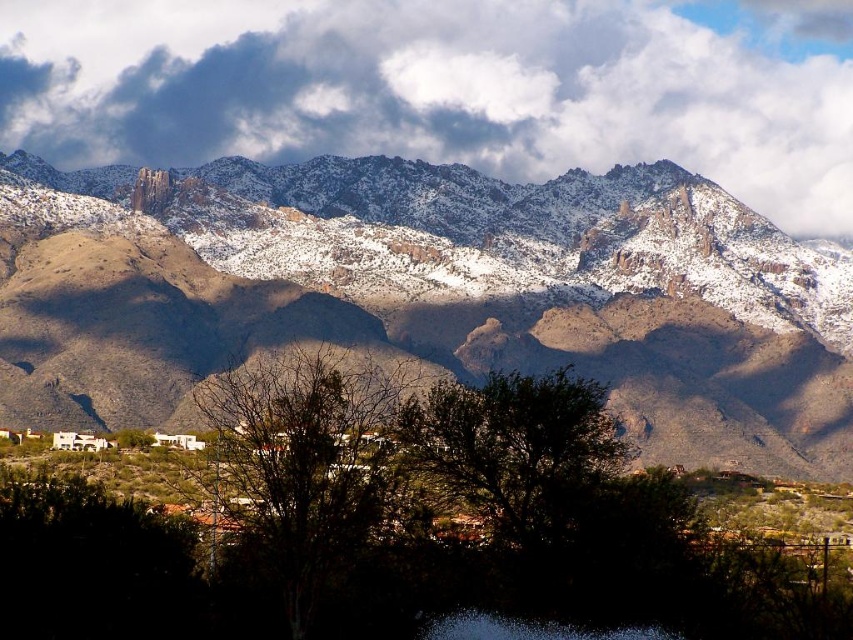
Who is higher up, snow-covered rock at upper center or white fluffy cloud at upper center?

white fluffy cloud at upper center

Who is more forward, (614, 330) or (215, 147)?

Point (614, 330)

At what (x,y) coordinates should I click in order to perform the action: click on snow-covered rock at upper center. Please return your answer as a coordinate pair (x, y). Image resolution: width=853 pixels, height=640 pixels. Looking at the image, I should click on (430, 292).